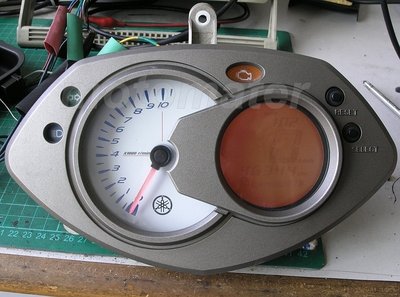
What are the coordinates of `wooden counter` in the screenshot? It's located at (48, 273).